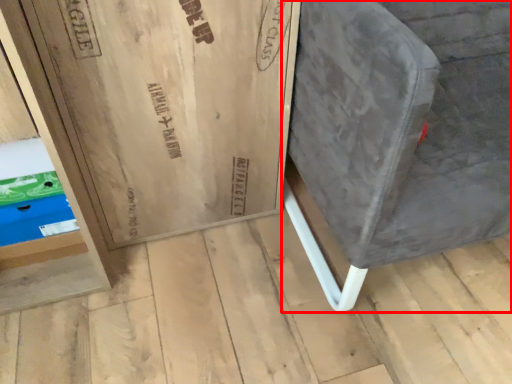
Question: In this image, where is furniture (annotated by the red box) located relative to shelf?

Choices:
 (A) right
 (B) left

Answer: (A)